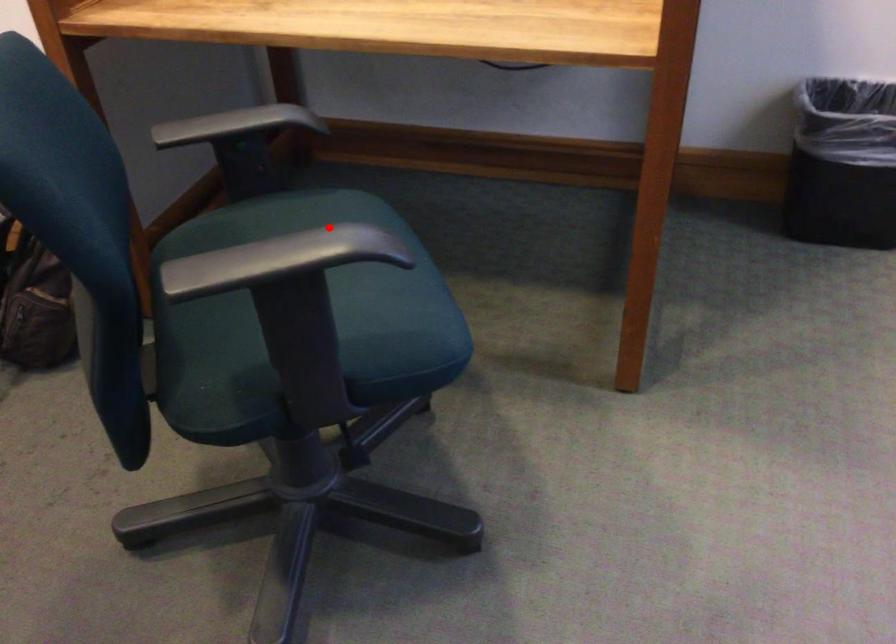
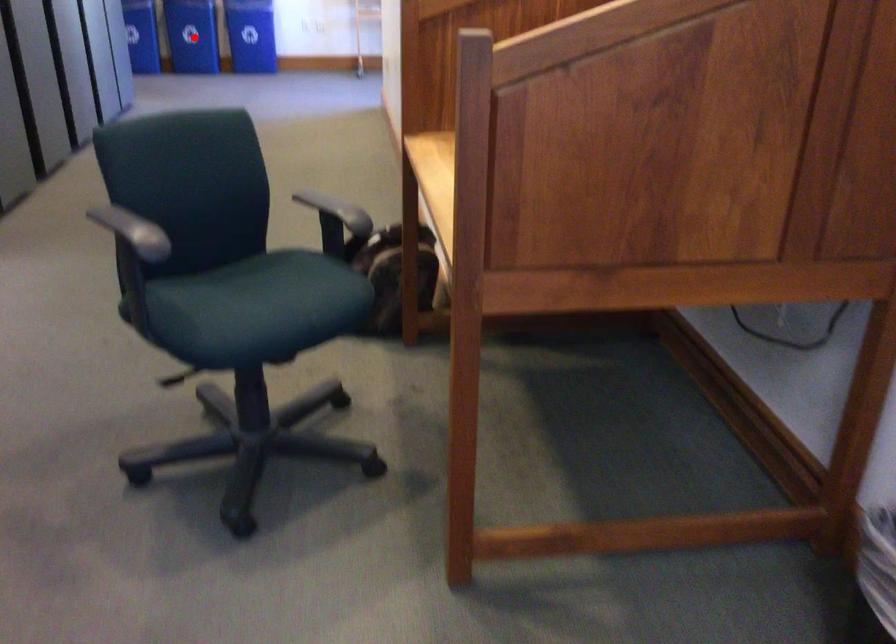
I am providing you with two images of the same scene from different viewpoints. A red point is marked on the first image and another point is marked on the second image. Do the highlighted points in image1 and image2 indicate the same real-world spot?

No